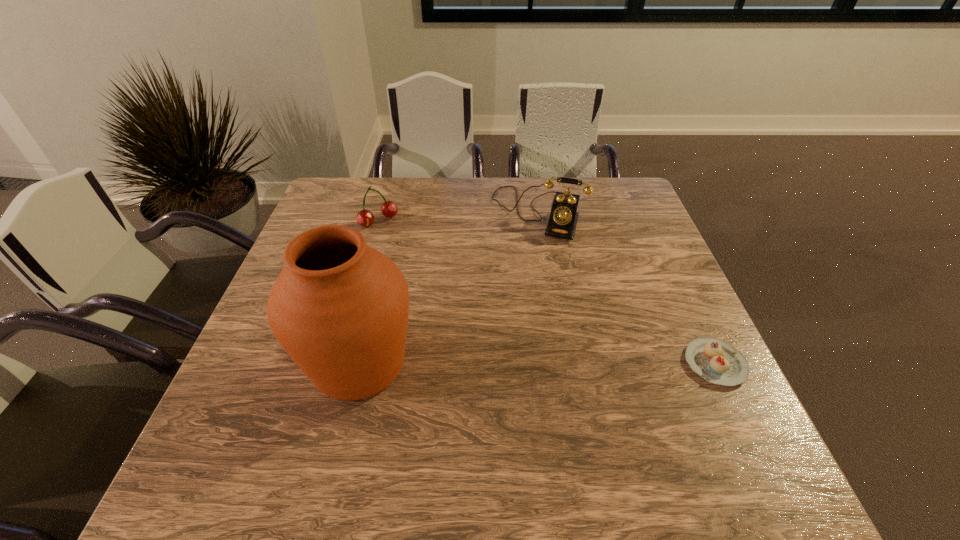
Find the location of a particular element. The height and width of the screenshot is (540, 960). free spot located with stems pointing upwards on the cherry is located at coordinates (459, 310).

I want to click on vacant space located with stems pointing upwards on the cherry, so click(447, 298).

This screenshot has height=540, width=960. Identify the location of vacant space located with stems pointing upwards on the cherry. [x=400, y=243].

Locate an element on the screen. telephone present at the far edge is located at coordinates (562, 223).

Locate an element on the screen. The image size is (960, 540). cherry that is at the far edge is located at coordinates (365, 218).

The image size is (960, 540). In order to click on object that is positioned at the near edge in this screenshot , I will do `click(339, 308)`.

At what (x,y) coordinates should I click in order to perform the action: click on urn that is at the left edge. Please return your answer as a coordinate pair (x, y). Looking at the image, I should click on (339, 308).

This screenshot has height=540, width=960. I want to click on cherry at the left edge, so click(365, 218).

Image resolution: width=960 pixels, height=540 pixels. What are the coordinates of `object that is positioned at the right edge` in the screenshot? It's located at (717, 361).

This screenshot has height=540, width=960. I want to click on object positioned at the far left corner, so click(365, 218).